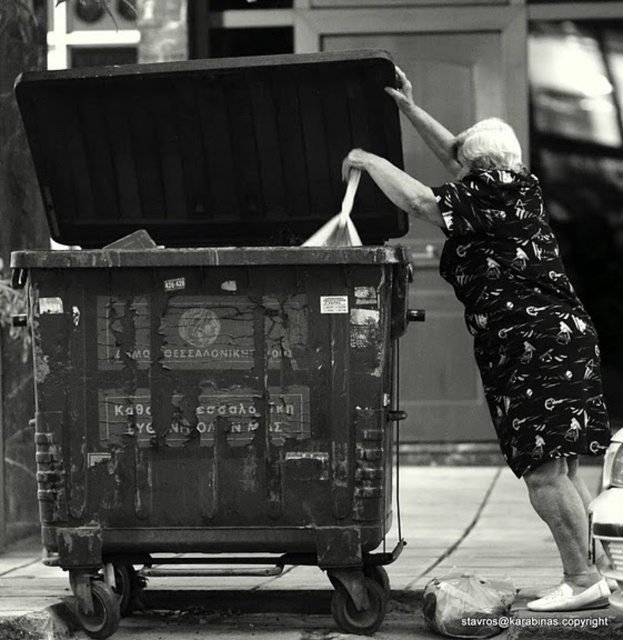
Who is higher up, printed fabric dress at upper right or plastic bag at lower right?

printed fabric dress at upper right is above.

Does printed fabric dress at upper right lie in front of plastic bag at lower right?

Yes, printed fabric dress at upper right is in front of plastic bag at lower right.

Who is more distant from viewer, (470,326) or (452,586)?

The point (470,326) is behind.

You are a GUI agent. You are given a task and a screenshot of the screen. Output one action in this format:
    pyautogui.click(x=<x>, y=<y>)
    Task: Click on the printed fabric dress at upper right
    This screenshot has height=640, width=623.
    Given the screenshot: What is the action you would take?
    pyautogui.click(x=515, y=323)

Is point (148, 408) closer to viewer compared to point (505, 593)?

That is True.

Is point (191, 381) farther from camera compared to point (483, 625)?

That is True.

This screenshot has width=623, height=640. Identify the location of rusty metal container at center. (212, 323).

The width and height of the screenshot is (623, 640). Find the location of `rusty metal container at center`. rusty metal container at center is located at coordinates (212, 323).

Does rusty metal container at center appear on the right side of printed fabric dress at upper right?

Incorrect, rusty metal container at center is not on the right side of printed fabric dress at upper right.

Does point (100, 102) come closer to viewer compared to point (558, 544)?

No, (100, 102) is behind (558, 544).

Find the location of a particular element. rusty metal container at center is located at coordinates (212, 323).